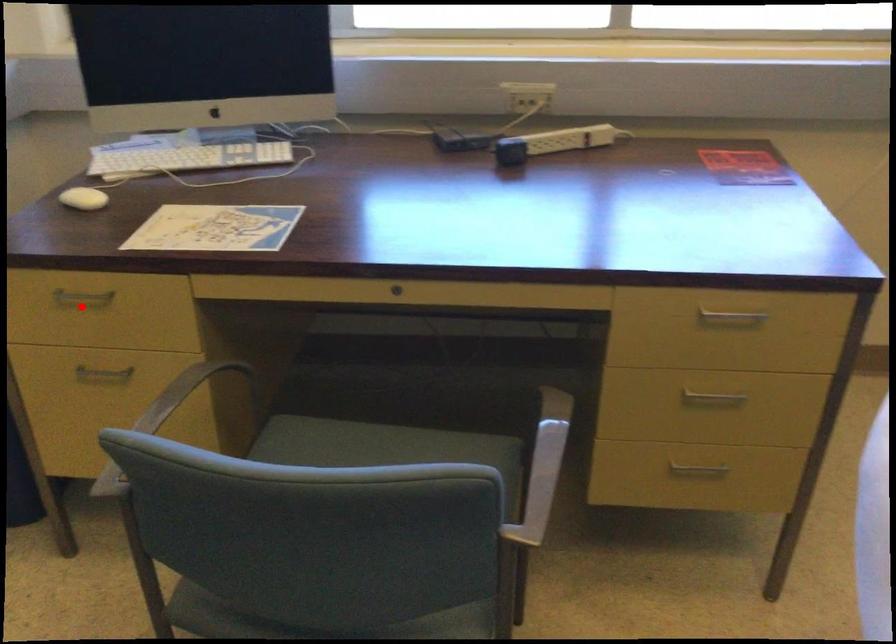
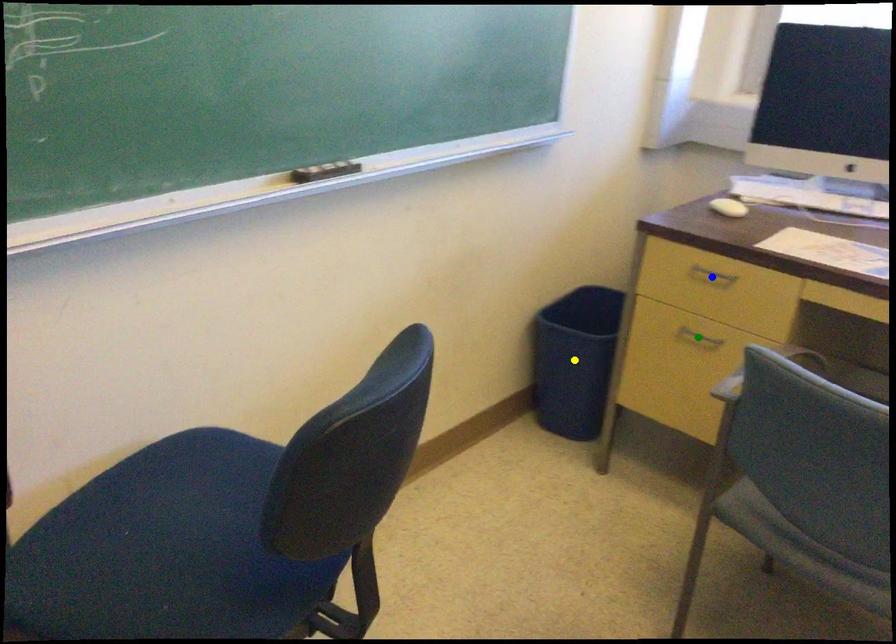
Question: I am providing you with two images of the same scene from different viewpoints. A red point is marked on the first image. You are given multiple points on the second image. Which mark in image 2 goes with the point in image 1?

Choices:
 (A) yellow point
 (B) green point
 (C) blue point

Answer: (C)